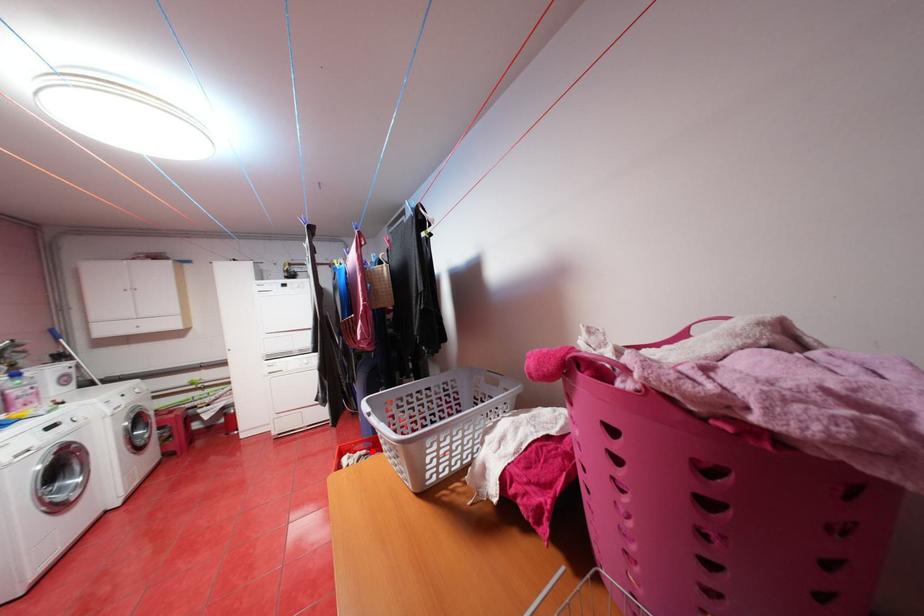
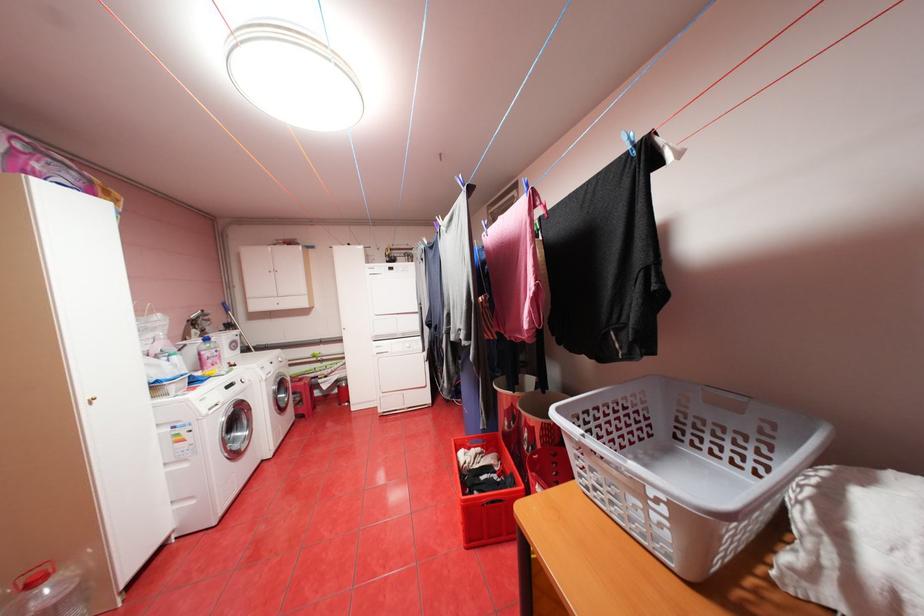
Question: I am providing you with two images of the same scene from different viewpoints. Image1 has a red point marked. In image2, the corresponding 3D location appears at what relative position? Reply with the corresponding letter.

Choices:
 (A) Closer
 (B) Farther

Answer: (A)